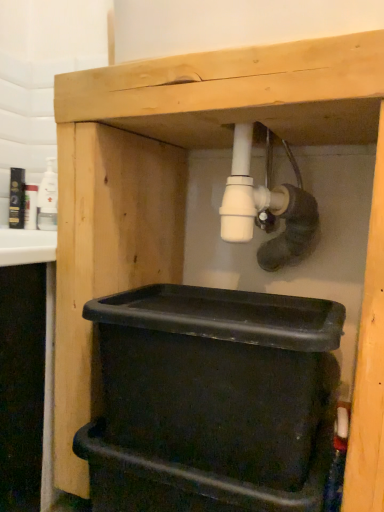
Question: In terms of height, does white glossy bottle at upper left look taller or shorter compared to black plastic bin at lower center?

Choices:
 (A) tall
 (B) short

Answer: (B)

Question: Considering their positions, is white glossy bottle at upper left located in front of or behind black plastic bin at lower center?

Choices:
 (A) behind
 (B) front

Answer: (A)

Question: From a real-world perspective, relative to black plastic bin at lower center, is white glossy bottle at upper left vertically above or below?

Choices:
 (A) above
 (B) below

Answer: (A)

Question: From a real-world perspective, relative to white glossy bottle at upper left, is black plastic bin at lower center vertically above or below?

Choices:
 (A) above
 (B) below

Answer: (B)

Question: Is black plastic bin at lower center in front of or behind white glossy bottle at upper left in the image?

Choices:
 (A) front
 (B) behind

Answer: (A)

Question: Considering the positions of point (284, 375) and point (54, 204), is point (284, 375) closer or farther from the camera than point (54, 204)?

Choices:
 (A) closer
 (B) farther

Answer: (A)

Question: Looking at the image, does black plastic bin at lower center seem bigger or smaller compared to white glossy bottle at upper left?

Choices:
 (A) small
 (B) big

Answer: (B)